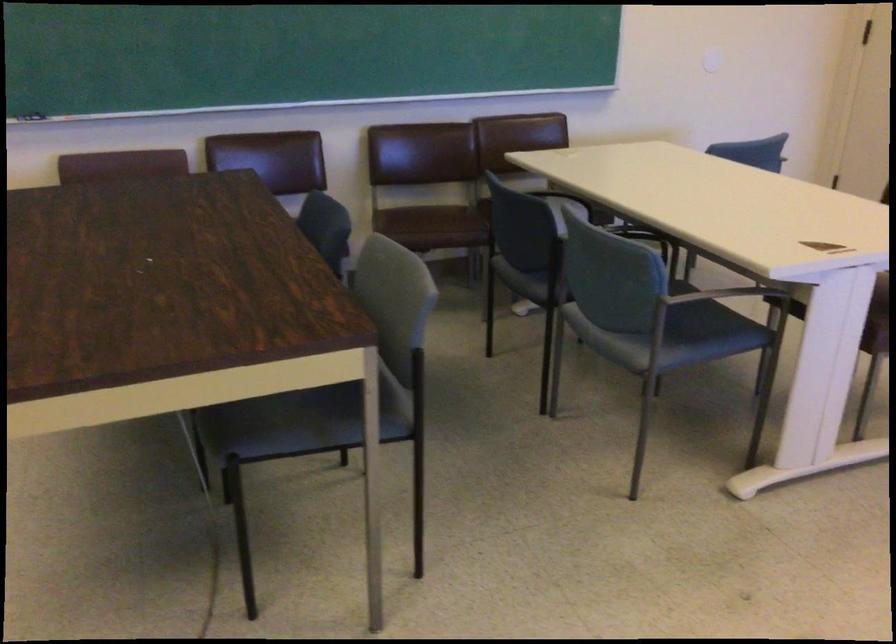
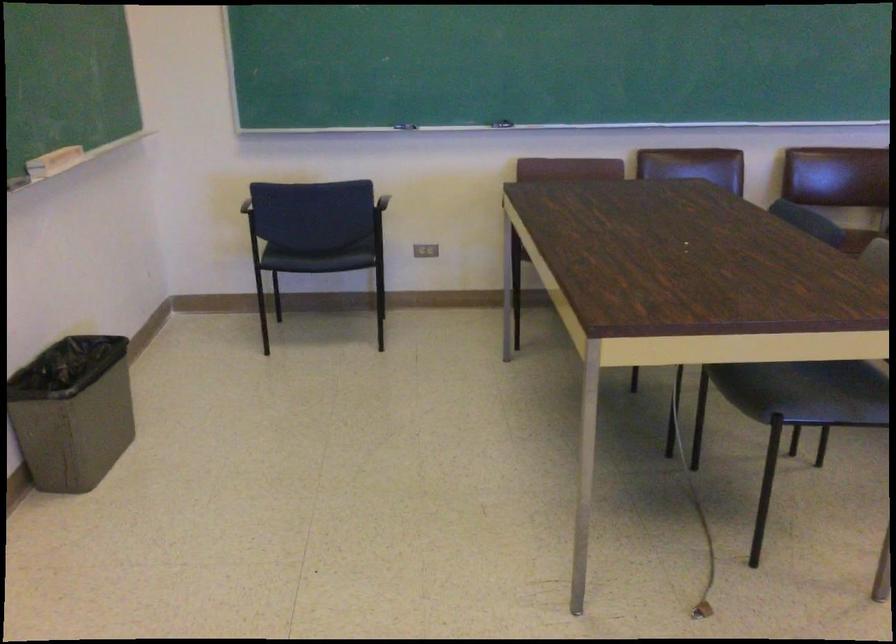
Locate, in the second image, the point that corresponds to point (251, 431) in the first image.

(765, 391)